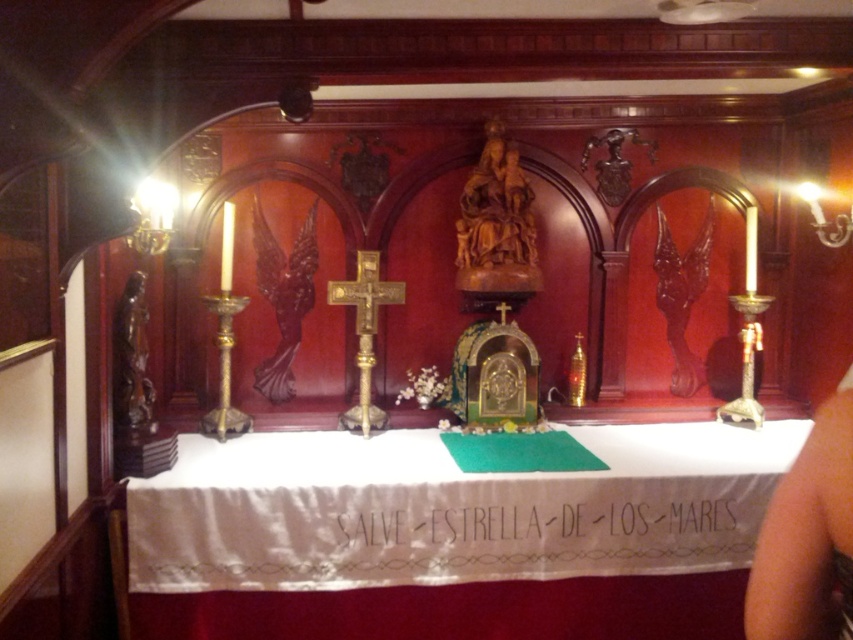
Question: Does white satin tablecloth at center appear under black fabric at center?

Choices:
 (A) no
 (B) yes

Answer: (A)

Question: Can you confirm if white satin tablecloth at center is positioned above black fabric at center?

Choices:
 (A) yes
 (B) no

Answer: (A)

Question: Among these points, which one is nearest to the camera?

Choices:
 (A) (633, 534)
 (B) (660, 538)

Answer: (A)

Question: Does white satin tablecloth at center appear on the left side of black fabric at center?

Choices:
 (A) no
 (B) yes

Answer: (B)